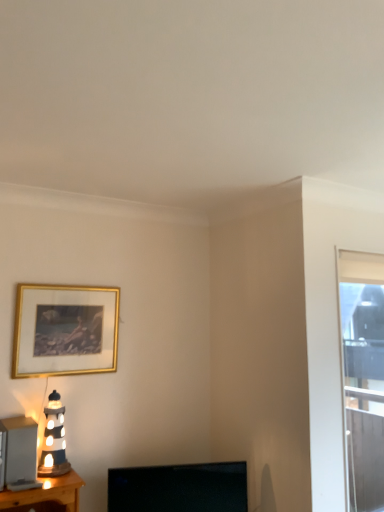
Question: Does transparent glass window at right come behind matte ceramic lighthouse at left?

Choices:
 (A) yes
 (B) no

Answer: (A)

Question: Are transparent glass window at right and matte ceramic lighthouse at left beside each other?

Choices:
 (A) no
 (B) yes

Answer: (A)

Question: From a real-world perspective, is transparent glass window at right located higher than matte ceramic lighthouse at left?

Choices:
 (A) yes
 (B) no

Answer: (A)

Question: Is transparent glass window at right not near matte ceramic lighthouse at left?

Choices:
 (A) no
 (B) yes

Answer: (B)

Question: Could you tell me if transparent glass window at right is facing matte ceramic lighthouse at left?

Choices:
 (A) no
 (B) yes

Answer: (A)

Question: Is transparent glass window at right shorter than matte ceramic lighthouse at left?

Choices:
 (A) no
 (B) yes

Answer: (A)

Question: Is there a large distance between matte black lamp at left and gold metallic picture frame at upper left?

Choices:
 (A) yes
 (B) no

Answer: (B)

Question: From a real-world perspective, is matte black lamp at left beneath gold metallic picture frame at upper left?

Choices:
 (A) no
 (B) yes

Answer: (B)

Question: Does matte black lamp at left appear on the right side of gold metallic picture frame at upper left?

Choices:
 (A) yes
 (B) no

Answer: (B)

Question: Does matte black lamp at left turn towards gold metallic picture frame at upper left?

Choices:
 (A) yes
 (B) no

Answer: (B)

Question: From the image's perspective, is matte black lamp at left on top of gold metallic picture frame at upper left?

Choices:
 (A) no
 (B) yes

Answer: (A)

Question: Considering the relative sizes of matte black lamp at left and gold metallic picture frame at upper left in the image provided, is matte black lamp at left smaller than gold metallic picture frame at upper left?

Choices:
 (A) yes
 (B) no

Answer: (A)

Question: Is gold metallic picture frame at upper left far from matte ceramic lighthouse at left?

Choices:
 (A) no
 (B) yes

Answer: (A)